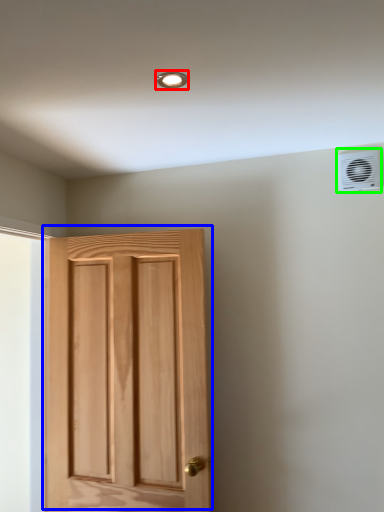
Question: Which object is the farthest from light fixture (highlighted by a red box)? Choose among these: door (highlighted by a blue box) or air conditioning (highlighted by a green box).

Choices:
 (A) door
 (B) air conditioning

Answer: (A)